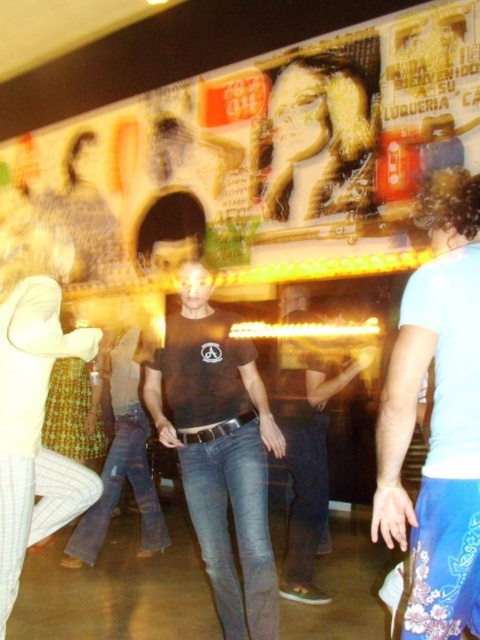
Which is in front, point (416, 621) or point (253, 355)?

Positioned in front is point (416, 621).

Locate an element on the screen. light blue denim jeans at center is located at coordinates (437, 422).

Does matte gold hair at upper center appear under black leather belt at center?

No.

Where is `matte gold hair at upper center`? This screenshot has height=640, width=480. matte gold hair at upper center is located at coordinates (316, 141).

Where is `matte gold hair at upper center`? matte gold hair at upper center is located at coordinates (316, 141).

Can you confirm if white cotton shirt at center is smaller than matte gold hair at upper center?

Correct, white cotton shirt at center occupies less space than matte gold hair at upper center.

Between point (43, 310) and point (328, 61), which one is positioned in front?

Point (43, 310) is more forward.

Between point (3, 292) and point (324, 196), which one is positioned behind?

Positioned behind is point (324, 196).

This screenshot has height=640, width=480. In order to click on white cotton shirt at center in this screenshot , I will do `click(35, 397)`.